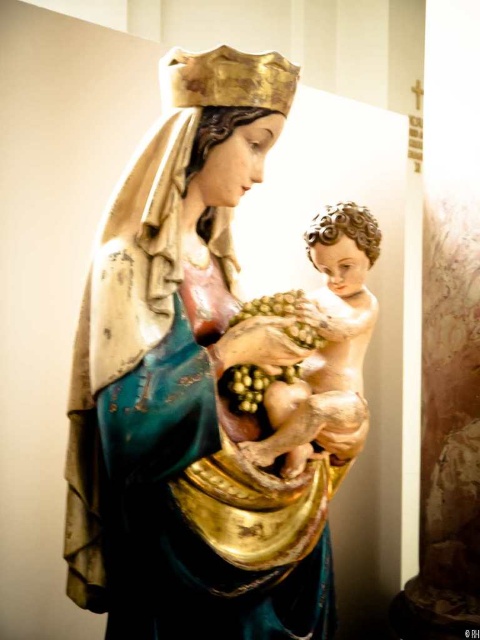
Question: Can you confirm if matte gold statue at center is positioned to the left of smooth wooden baby at center?

Choices:
 (A) yes
 (B) no

Answer: (A)

Question: Is matte gold statue at center to the right of smooth wooden baby at center from the viewer's perspective?

Choices:
 (A) yes
 (B) no

Answer: (B)

Question: Which object appears farthest from the camera in this image?

Choices:
 (A) matte gold statue at center
 (B) smooth wooden baby at center

Answer: (B)

Question: From the image, what is the correct spatial relationship of matte gold statue at center in relation to smooth wooden baby at center?

Choices:
 (A) below
 (B) above

Answer: (A)